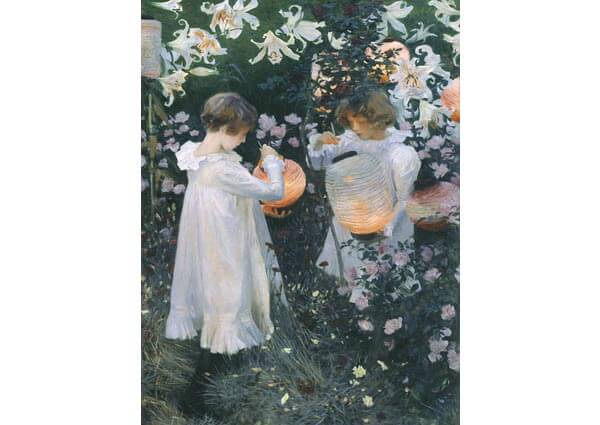
Identify the location of lantern. This screenshot has width=600, height=425. (373, 197), (295, 189).